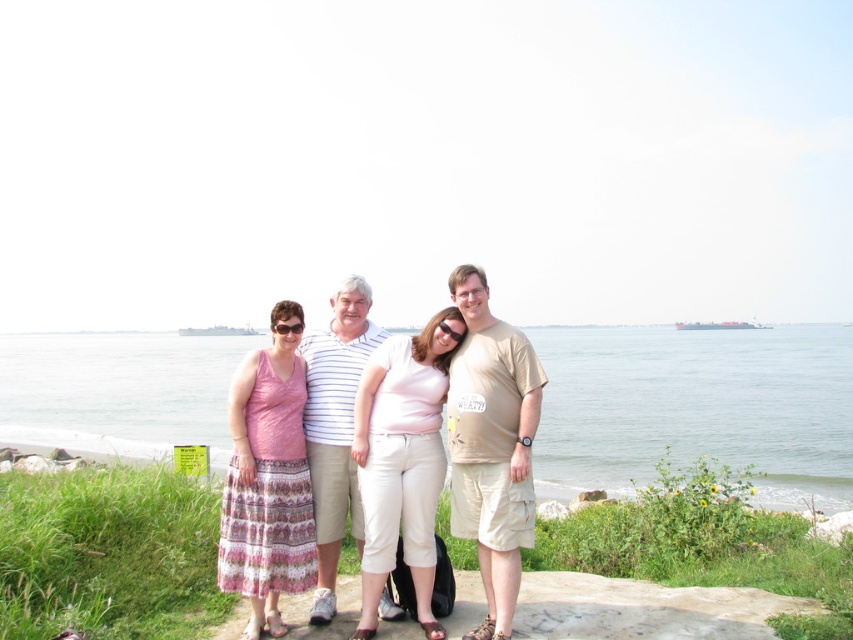
Between point (602, 339) and point (497, 404), which one is positioned in front?

Point (497, 404) is in front.

Who is shorter, blue water at center or tan cotton t-shirt at center?

tan cotton t-shirt at center is shorter.

Describe the element at coordinates (697, 408) in the screenshot. I see `blue water at center` at that location.

This screenshot has width=853, height=640. I want to click on blue water at center, so click(697, 408).

What do you see at coordinates (491, 445) in the screenshot? I see `tan cotton t-shirt at center` at bounding box center [491, 445].

Between point (488, 548) and point (357, 445), which one is positioned behind?

The point (357, 445) is more distant.

Is point (503, 451) positioned before point (492, 602)?

Yes, point (503, 451) is in front of point (492, 602).

Locate an element on the screen. Image resolution: width=853 pixels, height=640 pixels. tan cotton t-shirt at center is located at coordinates (491, 445).

Is point (833, 484) farther from camera compared to point (366, 432)?

Yes.

Which is in front, point (608, 492) or point (494, 416)?

Point (494, 416) is more forward.

At what (x,y) coordinates should I click in order to perform the action: click on blue water at center. Please return your answer as a coordinate pair (x, y). Image resolution: width=853 pixels, height=640 pixels. Looking at the image, I should click on (697, 408).